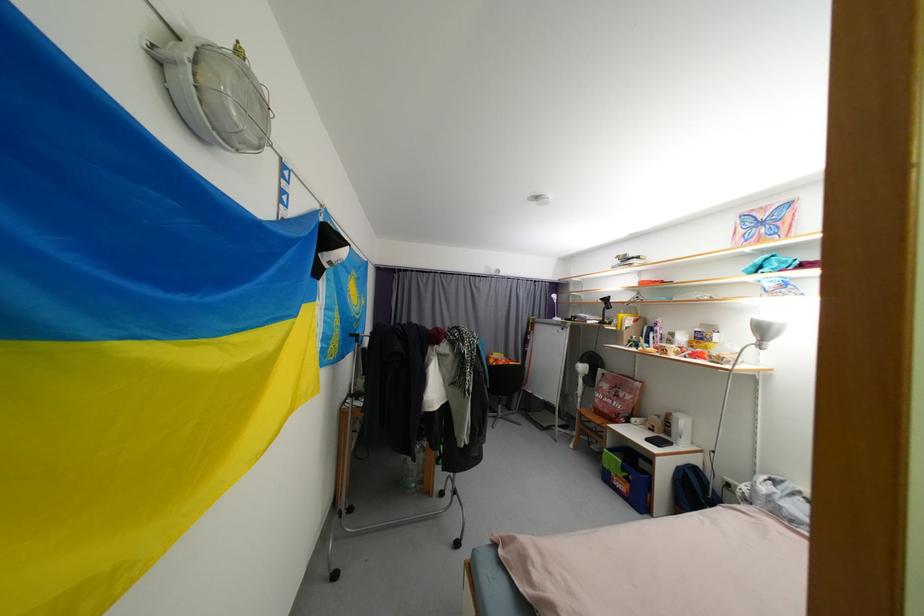
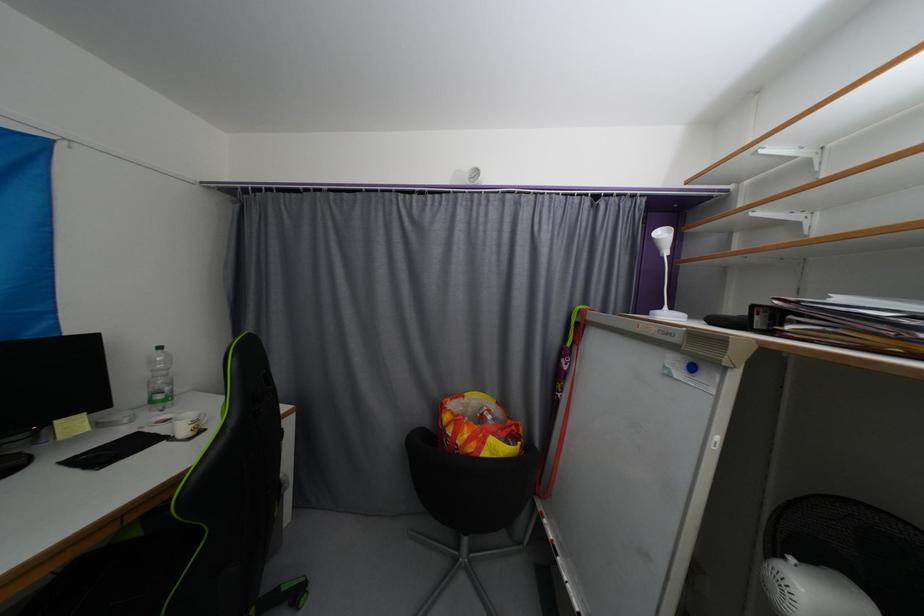
In the second image, find the point that corresponds to (562,321) in the first image.

(672, 317)